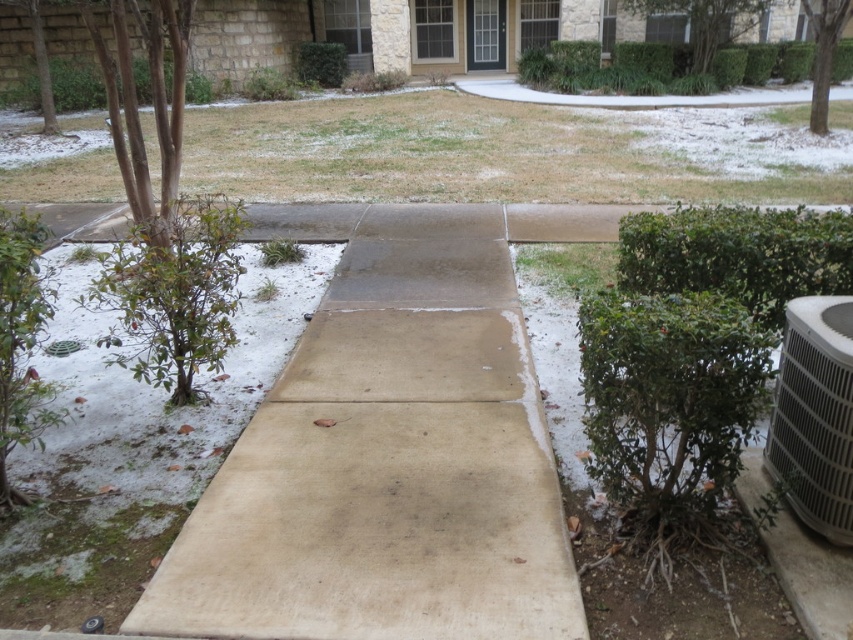
Question: Which of the following is the farthest from the observer?

Choices:
 (A) (779, 273)
 (B) (305, 448)
 (C) (767, 445)

Answer: (A)

Question: Which point appears closest to the camera in this image?

Choices:
 (A) (x=64, y=76)
 (B) (x=646, y=241)
 (C) (x=312, y=333)
 (D) (x=718, y=52)

Answer: (B)

Question: Is green leafy bush at right thinner than green leafy hedge at center?

Choices:
 (A) no
 (B) yes

Answer: (B)

Question: Is beige concrete path at center closer to camera compared to green leafy hedge at center?

Choices:
 (A) no
 (B) yes

Answer: (B)

Question: Which point is farther to the camera?

Choices:
 (A) green leafy bush at right
 (B) green leafy hedge at upper center
 (C) beige concrete path at center
 (D) gray metallic air conditioner at lower right

Answer: (B)

Question: Is green leafy bush at right thinner than green leafy hedge at upper left?

Choices:
 (A) yes
 (B) no

Answer: (B)